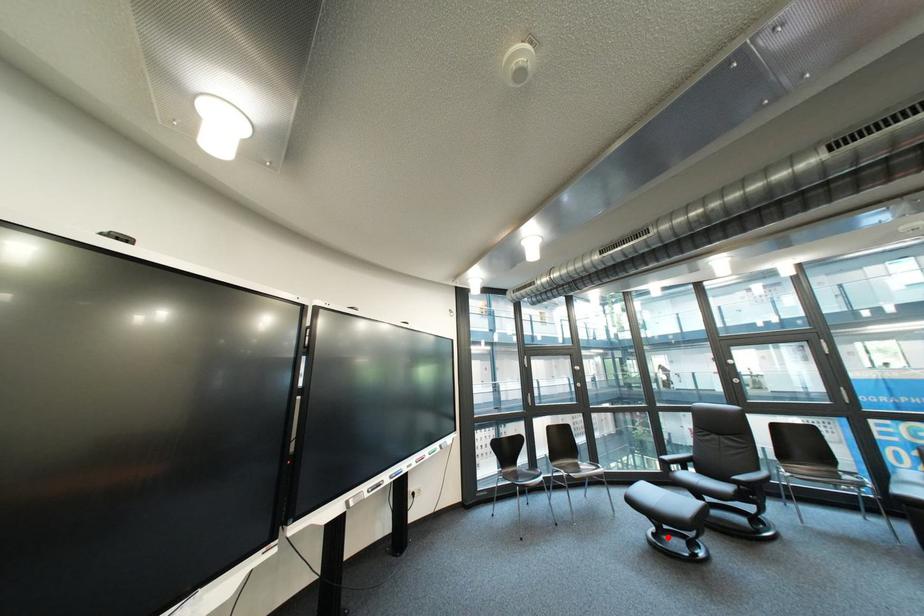
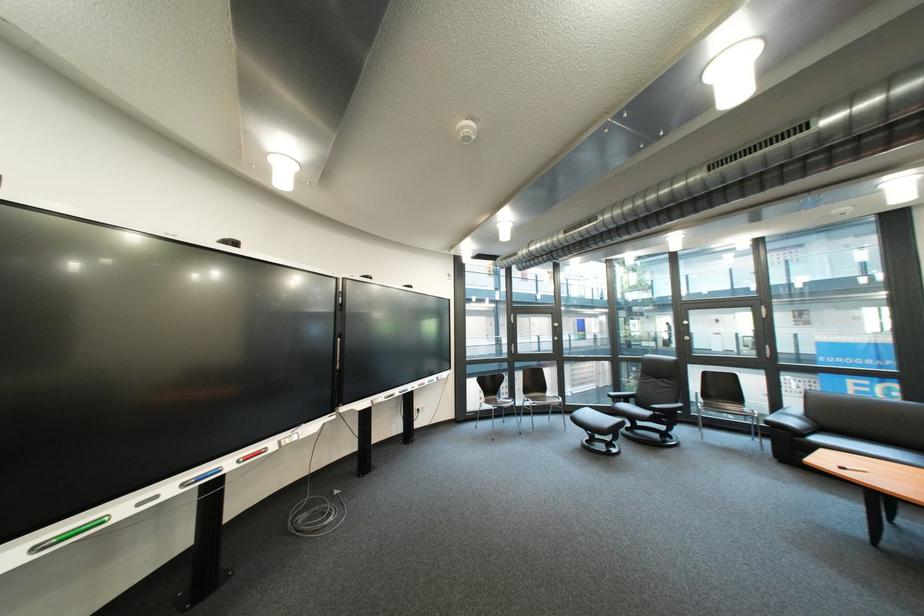
The point at the highlighted location is marked in the first image. Where is the corresponding point in the second image?

(601, 443)